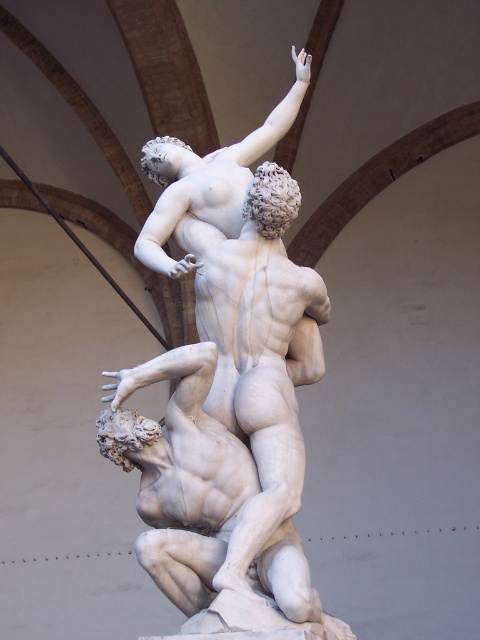
Can you confirm if white marble sculpture at center is positioned below white marble statue at upper center?

Yes, white marble sculpture at center is below white marble statue at upper center.

Does white marble sculpture at center have a lesser width compared to white marble statue at upper center?

Incorrect, white marble sculpture at center's width is not less than white marble statue at upper center's.

Find the location of a particular element. This screenshot has width=480, height=640. white marble sculpture at center is located at coordinates (228, 394).

Does white marble sculpture at center have a lesser width compared to white marble statue at center?

No, white marble sculpture at center is not thinner than white marble statue at center.

You are a GUI agent. You are given a task and a screenshot of the screen. Output one action in this format:
    pyautogui.click(x=<x>, y=<y>)
    Task: Click on the white marble sculpture at center
    This screenshot has height=640, width=480.
    Given the screenshot: What is the action you would take?
    pyautogui.click(x=228, y=394)

Between point (152, 358) and point (167, 202), which one is positioned behind?

Point (152, 358)

Which is in front, point (103, 435) or point (214, 214)?

Point (103, 435)

Does point (213, 353) come in front of point (219, 166)?

Yes, point (213, 353) is closer to viewer.

Locate an element on the screen. white marble statue at center is located at coordinates (180, 474).